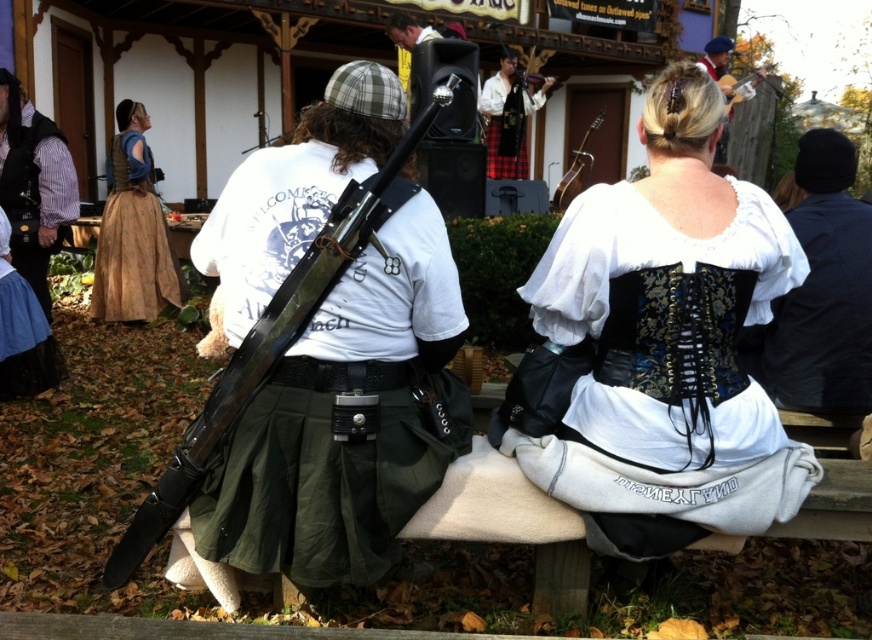
Question: Is green fabric skirt at center behind plaid fabric kilt at center?

Choices:
 (A) no
 (B) yes

Answer: (A)

Question: Is the position of black fabric jacket at right more distant than that of metallic silver speaker at center?

Choices:
 (A) no
 (B) yes

Answer: (A)

Question: Which point is farther to the camera?

Choices:
 (A) green fabric skirt at center
 (B) metallic silver speaker at center
 (C) black fabric jacket at right
 (D) white lace blouse at center

Answer: (B)

Question: Which of these objects is positioned closest to the plaid fabric kilt at center?

Choices:
 (A) brown woven skirt at upper left
 (B) white lace blouse at center

Answer: (A)

Question: Among these objects, which one is nearest to the camera?

Choices:
 (A) brown woven skirt at upper left
 (B) white lace blouse at center
 (C) black fabric jacket at right

Answer: (B)

Question: Is plaid fabric kilt at center wider than metallic silver speaker at center?

Choices:
 (A) no
 (B) yes

Answer: (B)